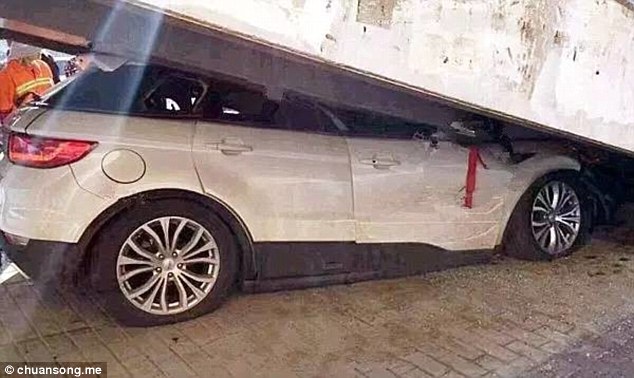
This screenshot has height=378, width=634. Identify the location of right front window. (359, 118).